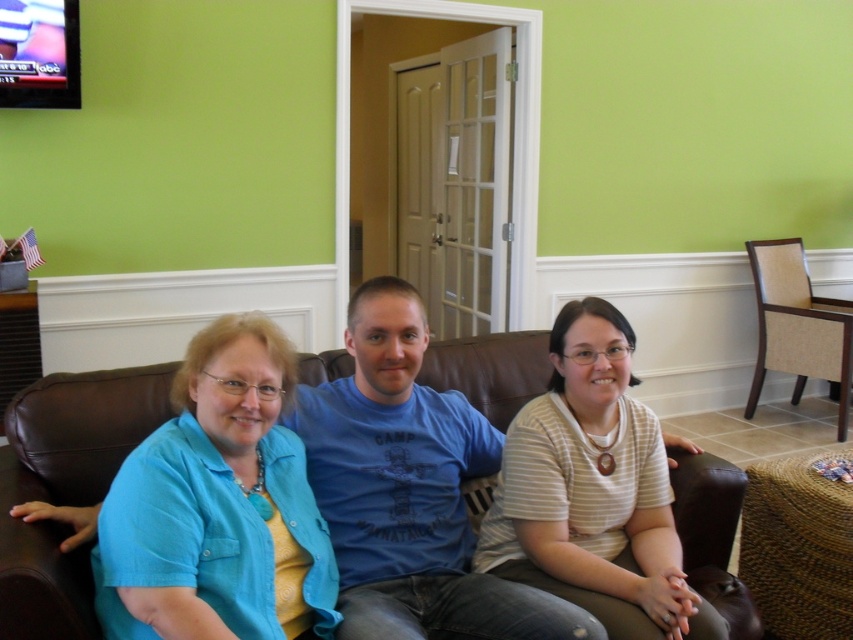
You are trying to decide which shirt to wear for a casual day out. Both the blue cotton shirt at left and the white striped shirt at center are options. Based on their sizes, which one is narrower?

The blue cotton shirt at left is narrower than the white striped shirt at center because its width is less than the latter.